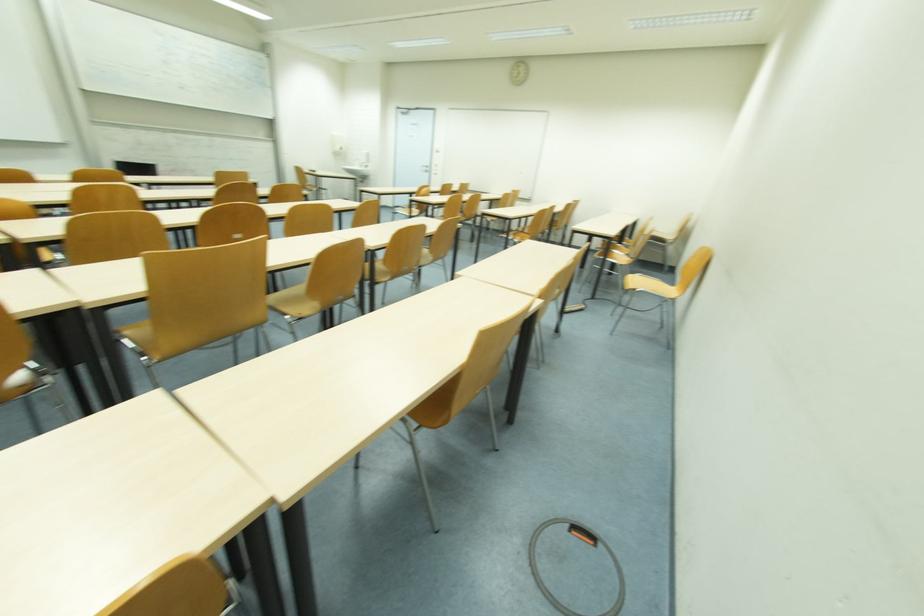
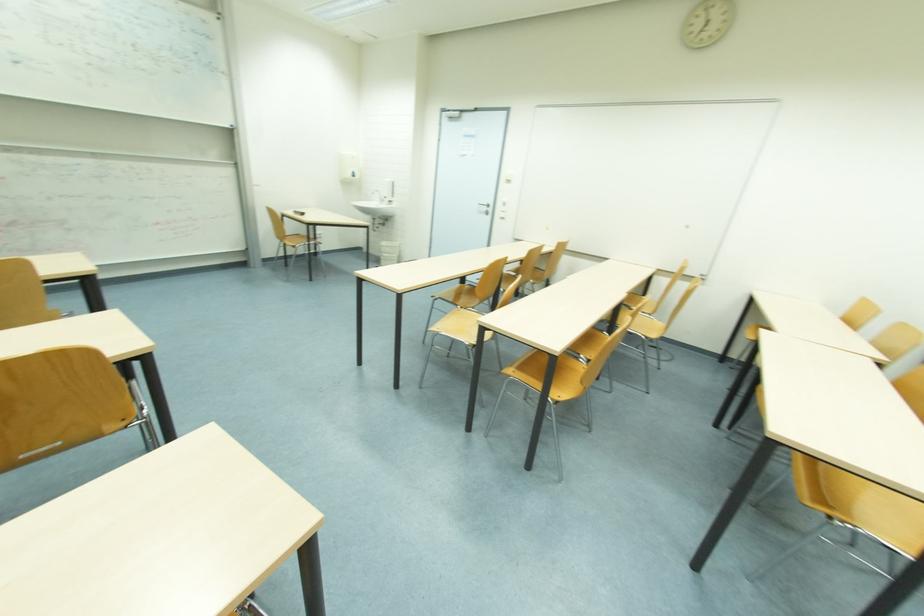
Question: Which direction would the cameraman need to move to produce the second image? Reply with the corresponding letter.

Choices:
 (A) Left
 (B) Right
 (C) Forward
 (D) Backward

Answer: (C)